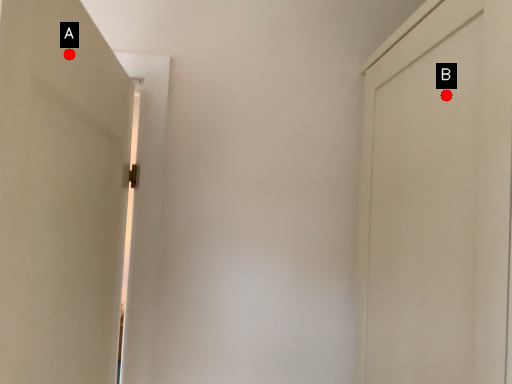
Question: Two points are circled on the image, labeled by A and B beside each circle. Which of the following is the farthest from the observer?

Choices:
 (A) A is further
 (B) B is further

Answer: (B)